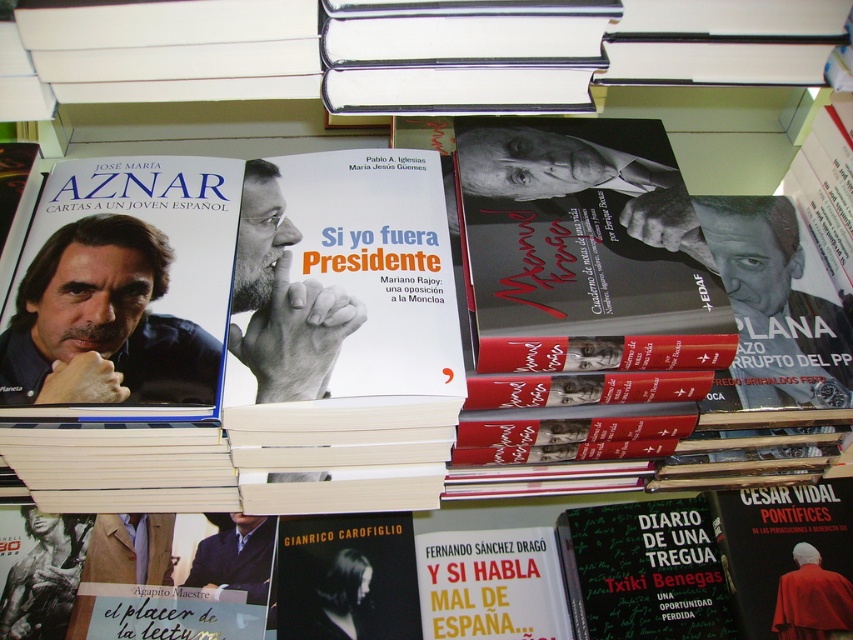
What is the 2D coordinate of the green matte book at lower center?

The green matte book at lower center is located at the 2D coordinate point of (643, 572).

You are a librarian who needs to place a 60 cm wide box between the matte black book cover at left and the red velvet robe at lower right. Can you fit the box without moving either object?

The distance between the matte black book cover at left and the red velvet robe at lower right is 70.36 centimeters. Since the box is 60 centimeters wide, there is enough space to place it between them without moving either object.

You are a librarian who needs to place a 10 cm tall book on the shelf. You have two options in the image, the green matte book at lower center and the red velvet robe at lower right. Which one can accommodate the new book without exceeding its height?

The green matte book at lower center has a greater height compared to the red velvet robe at lower right, so the new 10 cm tall book can be placed on either since both are taller than 10 cm. However, the green matte book at lower center would provide more vertical space.